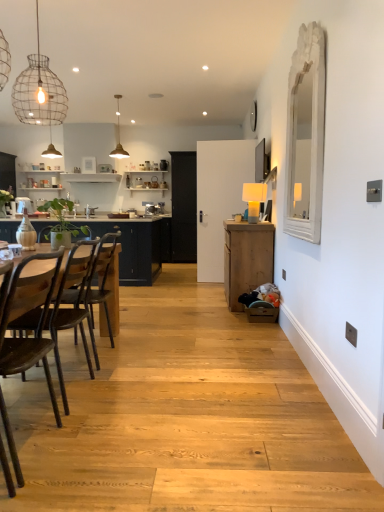
This screenshot has height=512, width=384. What do you see at coordinates (184, 207) in the screenshot?
I see `black glass door at center` at bounding box center [184, 207].

Where is `dark wood chair at left, which ranks as the 3th chair in back-to-front order`? This screenshot has width=384, height=512. dark wood chair at left, which ranks as the 3th chair in back-to-front order is located at coordinates (36, 324).

This screenshot has height=512, width=384. Describe the element at coordinates (254, 199) in the screenshot. I see `matte yellow lampshade at center-right, which ranks as the second lamp in left-to-right order` at that location.

The width and height of the screenshot is (384, 512). Identify the location of matte yellow lampshade at center-right, positioned as the first lamp in right-to-left order. (254, 199).

Locate an element on the screen. This screenshot has height=512, width=384. metallic pendant light at upper center, which is the first lamp from top to bottom is located at coordinates (118, 136).

From the image's perspective, is wire mesh light fixture at upper left below blue matte countertop at left?

No, from the image's perspective, wire mesh light fixture at upper left is not beneath blue matte countertop at left.

Considering the relative positions of wire mesh light fixture at upper left and blue matte countertop at left in the image provided, is wire mesh light fixture at upper left to the left or to the right of blue matte countertop at left?

Clearly, wire mesh light fixture at upper left is on the right of blue matte countertop at left in the image.

Considering the positions of point (37, 31) and point (97, 234), is point (37, 31) closer or farther from the camera than point (97, 234)?

Point (37, 31).

I want to click on countertop that appears behind the wire mesh light fixture at upper left, so click(138, 247).

What's the angular difference between metallic pendant light at upper center, the 1th lamp from the back, and blue matte countertop at left's facing directions?

2.55 degrees.

Does metallic pendant light at upper center, marked as the second lamp in a bottom-to-top arrangement, turn towards blue matte countertop at left?

No, metallic pendant light at upper center, marked as the second lamp in a bottom-to-top arrangement, is not aimed at blue matte countertop at left.

Between metallic pendant light at upper center, acting as the 2th lamp starting from the right, and blue matte countertop at left, which one appears on the left side from the viewer's perspective?

blue matte countertop at left is more to the left.

Considering the sizes of objects metallic pendant light at upper center, marked as the second lamp in a bottom-to-top arrangement, and blue matte countertop at left in the image provided, who is thinner, metallic pendant light at upper center, marked as the second lamp in a bottom-to-top arrangement, or blue matte countertop at left?

With smaller width is metallic pendant light at upper center, marked as the second lamp in a bottom-to-top arrangement.

Is point (273, 263) closer to viewer compared to point (146, 222)?

Yes.

Consider the image. Is wooden cabinet at right spatially inside blue matte countertop at left, or outside of it?

wooden cabinet at right cannot be found inside blue matte countertop at left.

Based on the photo, from the image's perspective, between wooden cabinet at right and blue matte countertop at left, who is located below?

wooden cabinet at right, from the image's perspective.

Looking at their sizes, would you say wooden cabinet at right is wider or thinner than blue matte countertop at left?

In the image, wooden cabinet at right appears to be more narrow than blue matte countertop at left.

Measure the distance from black glass door at center to blue matte countertop at left.

20.88 inches.

Is the position of black glass door at center less distant than that of blue matte countertop at left?

No, the depth of black glass door at center is greater than that of blue matte countertop at left.

Considering the relative sizes of black glass door at center and blue matte countertop at left in the image provided, is black glass door at center bigger than blue matte countertop at left?

Incorrect, black glass door at center is not larger than blue matte countertop at left.

Between black glass door at center and blue matte countertop at left, which one has more height?

black glass door at center is taller.

Is matte yellow lampshade at center-right, arranged as the second lamp when viewed from the top, to the left of blue matte countertop at left from the viewer's perspective?

No, matte yellow lampshade at center-right, arranged as the second lamp when viewed from the top, is not to the left of blue matte countertop at left.

Between matte yellow lampshade at center-right, placed as the first lamp when sorted from front to back, and blue matte countertop at left, which one is positioned behind?

blue matte countertop at left is more distant.

Between matte yellow lampshade at center-right, which is the first lamp in bottom-to-top order, and blue matte countertop at left, which one has larger size?

With larger size is blue matte countertop at left.

Choose the correct answer: Is matte yellow lampshade at center-right, which is the first lamp in bottom-to-top order, inside blue matte countertop at left or outside it?

matte yellow lampshade at center-right, which is the first lamp in bottom-to-top order, is not enclosed by blue matte countertop at left.

Choose the correct answer: Is black glass door at center inside matte yellow lampshade at center-right, placed as the first lamp when sorted from front to back, or outside it?

black glass door at center is not enclosed by matte yellow lampshade at center-right, placed as the first lamp when sorted from front to back.

Based on their positions, is black glass door at center located to the left or right of matte yellow lampshade at center-right, positioned as the first lamp in right-to-left order?

black glass door at center is to the left of matte yellow lampshade at center-right, positioned as the first lamp in right-to-left order.

From the picture: Considering the positions of objects black glass door at center and matte yellow lampshade at center-right, which ranks as the second lamp in left-to-right order, in the image provided, who is behind, black glass door at center or matte yellow lampshade at center-right, which ranks as the second lamp in left-to-right order,?

black glass door at center.

Based on the photo, who is shorter, black glass door at center or matte yellow lampshade at center-right, arranged as the second lamp when viewed from the top?

matte yellow lampshade at center-right, arranged as the second lamp when viewed from the top, is shorter.

Based on the photo, in the image, is wooden chair at left, the 3th chair viewed from the front, positioned in front of or behind metallic pendant light at upper center, which is the first lamp from top to bottom?

wooden chair at left, the 3th chair viewed from the front, is in front of metallic pendant light at upper center, which is the first lamp from top to bottom.

There is a metallic pendant light at upper center, acting as the 2th lamp starting from the right. Where is `the 2nd chair below it (from a real-world perspective)`? The image size is (384, 512). the 2nd chair below it (from a real-world perspective) is located at coordinates (85, 287).

Can you confirm if wooden chair at left, arranged as the first chair when viewed from the back, is shorter than metallic pendant light at upper center, marked as the second lamp in a bottom-to-top arrangement?

No, wooden chair at left, arranged as the first chair when viewed from the back, is not shorter than metallic pendant light at upper center, marked as the second lamp in a bottom-to-top arrangement.

Can you confirm if wooden chair at left, the 3th chair viewed from the front, is positioned to the left of metallic pendant light at upper center, the 1th lamp from the back?

Incorrect, wooden chair at left, the 3th chair viewed from the front, is not on the left side of metallic pendant light at upper center, the 1th lamp from the back.

Where is `countertop behind the wire mesh light fixture at upper left`? Image resolution: width=384 pixels, height=512 pixels. countertop behind the wire mesh light fixture at upper left is located at coordinates (138, 247).

The height and width of the screenshot is (512, 384). Find the location of `countertop on the left of metallic pendant light at upper center, the 1th lamp in the left-to-right sequence`. countertop on the left of metallic pendant light at upper center, the 1th lamp in the left-to-right sequence is located at coordinates (138, 247).

Which object lies nearer to the anchor point metallic pendant light at upper center, marked as the second lamp in a bottom-to-top arrangement, dark wood chair at left, which ranks as the 3th chair in back-to-front order, or wooden chair at left, the 3th chair viewed from the front?

Among the two, wooden chair at left, the 3th chair viewed from the front, is located nearer to metallic pendant light at upper center, marked as the second lamp in a bottom-to-top arrangement.

From the image, which object appears to be farther from metallic pendant light at upper center, acting as the 2th lamp starting from the right, dark wood chair at left, which appears as the 1th chair when viewed from the front, or dark brown wood chair at left, which is the 2th chair from front to back?

dark wood chair at left, which appears as the 1th chair when viewed from the front, is further to metallic pendant light at upper center, acting as the 2th lamp starting from the right.

Looking at this image, estimate the real-world distances between objects in this image. Which object is further from dark wood chair at left, which appears as the 1th chair when viewed from the front, blue matte countertop at left or wire mesh light fixture at upper left?

The object further to dark wood chair at left, which appears as the 1th chair when viewed from the front, is blue matte countertop at left.

Looking at the image, which one is located further to metallic pendant light at upper center, acting as the 2th lamp starting from the right, wooden chair at left, the 3th chair viewed from the front, or blue matte countertop at left?

The object further to metallic pendant light at upper center, acting as the 2th lamp starting from the right, is wooden chair at left, the 3th chair viewed from the front.

Based on their spatial positions, is matte yellow lampshade at center-right, arranged as the second lamp when viewed from the top, or wire mesh light fixture at upper left further from dark brown wood chair at left, which is the 2th chair from front to back?

wire mesh light fixture at upper left lies further to dark brown wood chair at left, which is the 2th chair from front to back, than the other object.

Based on their spatial positions, is wooden cabinet at right or dark brown wood chair at left, which is the 2th chair from front to back, closer to matte yellow lampshade at center-right, positioned as the first lamp in right-to-left order?

Based on the image, wooden cabinet at right appears to be nearer to matte yellow lampshade at center-right, positioned as the first lamp in right-to-left order.

Estimate the real-world distances between objects in this image. Which object is closer to wire mesh light fixture at upper left, metallic pendant light at upper center, the 1th lamp from the back, or blue matte countertop at left?

metallic pendant light at upper center, the 1th lamp from the back, is positioned closer to the anchor wire mesh light fixture at upper left.

When comparing their distances from black glass door at center, does wire mesh light fixture at upper left or dark brown wood chair at left, which is the 2th chair from front to back, seem closer?

wire mesh light fixture at upper left is positioned closer to the anchor black glass door at center.

Locate an element on the screen. light fixture between dark wood chair at left, which appears as the 1th chair when viewed from the front, and black glass door at center in the front-back direction is located at coordinates (39, 92).

Identify the location of chair located between dark brown wood chair at left, which is the 2th chair from front to back, and black glass door at center in the depth direction. coord(85,287).

I want to click on lamp located between dark brown wood chair at left, the 2th chair from the back, and blue matte countertop at left in the depth direction, so click(254, 199).

Image resolution: width=384 pixels, height=512 pixels. Find the location of `light fixture between dark brown wood chair at left, the 2th chair from the back, and black glass door at center from front to back`. light fixture between dark brown wood chair at left, the 2th chair from the back, and black glass door at center from front to back is located at coordinates (39, 92).